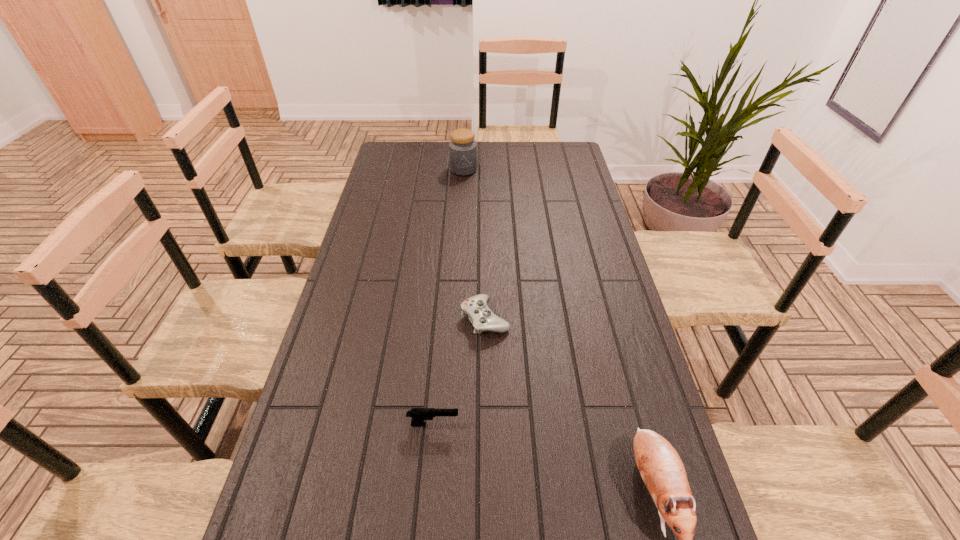
Identify the location of vacant region that satisfies the following two spatial constraints: 1. on the surface of the jar near the warning symbol; 2. on the front-facing side of the pistol. The width and height of the screenshot is (960, 540). (450, 424).

At what (x,y) coordinates should I click in order to perform the action: click on vacant area that satisfies the following two spatial constraints: 1. on the surface of the farthest object near the warning symbol; 2. on the front-facing side of the second nearest object. Please return your answer as a coordinate pair (x, y). This screenshot has height=540, width=960. Looking at the image, I should click on (450, 424).

This screenshot has height=540, width=960. What are the coordinates of `free space that satisfies the following two spatial constraints: 1. on the surface of the jar near the warning symbol; 2. on the front-facing side of the second nearest object` in the screenshot? It's located at (450, 424).

Where is `free location that satisfies the following two spatial constraints: 1. on the surface of the jar near the warning symbol; 2. on the right side of the control`? The image size is (960, 540). free location that satisfies the following two spatial constraints: 1. on the surface of the jar near the warning symbol; 2. on the right side of the control is located at coordinates (456, 319).

What are the coordinates of `free location that satisfies the following two spatial constraints: 1. on the surface of the jar near the warning symbol; 2. on the front-facing side of the second nearest object` in the screenshot? It's located at (450, 424).